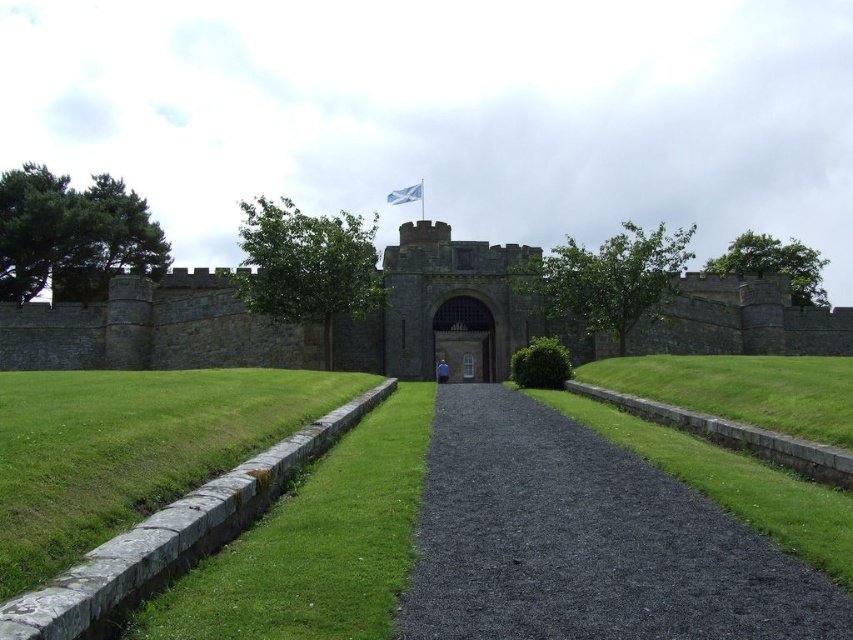
Can you confirm if stone wall at center is taller than dark stone gate at center?

Yes, stone wall at center is taller than dark stone gate at center.

Locate an element on the screen. This screenshot has height=640, width=853. stone wall at center is located at coordinates (154, 330).

Who is more distant from viewer, (x=560, y=326) or (x=747, y=365)?

The point (x=560, y=326) is more distant.

What do you see at coordinates (154, 330) in the screenshot? Image resolution: width=853 pixels, height=640 pixels. I see `stone wall at center` at bounding box center [154, 330].

Which is behind, point (520, 344) or point (718, 380)?

Positioned behind is point (520, 344).

This screenshot has width=853, height=640. I want to click on stone wall at center, so tap(154, 330).

Is stone wall at center closer to the viewer compared to green grass at lower left?

No, stone wall at center is behind green grass at lower left.

Measure the distance between point (434, 284) and camera.

A distance of 94.24 meters exists between point (434, 284) and camera.

Which is in front, point (268, 360) or point (178, 627)?

Point (178, 627) is in front.

At what (x,y) coordinates should I click in order to perform the action: click on stone wall at center. Please return your answer as a coordinate pair (x, y). This screenshot has width=853, height=640. Looking at the image, I should click on (154, 330).